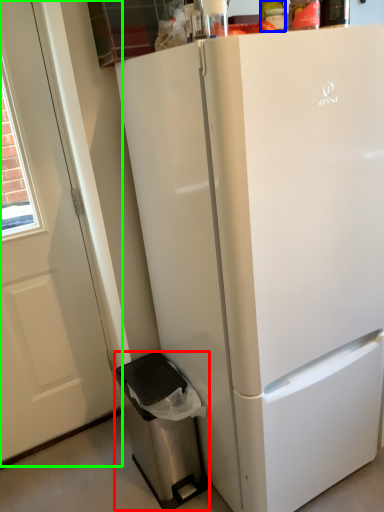
Question: Considering the real-world distances, which object is closest to dish washer (highlighted by a red box)? bottle (highlighted by a blue box) or screen door (highlighted by a green box).

Choices:
 (A) bottle
 (B) screen door

Answer: (B)